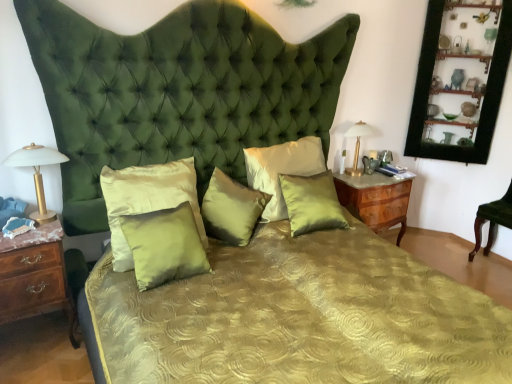
Question: From a real-world perspective, does black wood picture frame at upper right sit lower than satin green pillow at center, which appears as the fifth pillow when viewed from the left?

Choices:
 (A) yes
 (B) no

Answer: (B)

Question: Is black wood picture frame at upper right turned away from satin green pillow at center, which appears as the fifth pillow when viewed from the left?

Choices:
 (A) no
 (B) yes

Answer: (A)

Question: Would you say black wood picture frame at upper right is outside satin green pillow at center, the first pillow when ordered from right to left?

Choices:
 (A) no
 (B) yes

Answer: (B)

Question: Can satin green pillow at center, which appears as the fifth pillow when viewed from the left, be found inside black wood picture frame at upper right?

Choices:
 (A) no
 (B) yes

Answer: (A)

Question: Could you tell me if black wood picture frame at upper right is facing satin green pillow at center, the first pillow when ordered from right to left?

Choices:
 (A) yes
 (B) no

Answer: (B)

Question: In the image, is black wood picture frame at upper right on the left side or the right side of wooden nightstand at left, marked as the first nightstand in a left-to-right arrangement?

Choices:
 (A) left
 (B) right

Answer: (B)

Question: From their relative heights in the image, would you say black wood picture frame at upper right is taller or shorter than wooden nightstand at left, the 1th nightstand when ordered from front to back?

Choices:
 (A) tall
 (B) short

Answer: (A)

Question: Relative to wooden nightstand at left, marked as the first nightstand in a left-to-right arrangement, is black wood picture frame at upper right in front or behind?

Choices:
 (A) behind
 (B) front

Answer: (A)

Question: In terms of width, does black wood picture frame at upper right look wider or thinner when compared to wooden nightstand at left, positioned as the second nightstand in right-to-left order?

Choices:
 (A) thin
 (B) wide

Answer: (A)

Question: From the image's perspective, is matte gold table lamp at left, which is the first bedside lamp in front-to-back order, above or below satin green pillow at center, positioned as the third pillow in right-to-left order?

Choices:
 (A) below
 (B) above

Answer: (B)

Question: In the image, is matte gold table lamp at left, which is the first bedside lamp in front-to-back order, on the left side or the right side of satin green pillow at center, the third pillow in the left-to-right sequence?

Choices:
 (A) left
 (B) right

Answer: (A)

Question: In terms of width, does matte gold table lamp at left, the second bedside lamp in the right-to-left sequence, look wider or thinner when compared to satin green pillow at center, positioned as the third pillow in right-to-left order?

Choices:
 (A) thin
 (B) wide

Answer: (A)

Question: Considering the positions of point [44, 213] and point [209, 220], is point [44, 213] closer or farther from the camera than point [209, 220]?

Choices:
 (A) closer
 (B) farther

Answer: (A)

Question: Is black wood picture frame at upper right inside or outside of satin green pillow at center, the third pillow in the left-to-right sequence?

Choices:
 (A) inside
 (B) outside

Answer: (B)

Question: Is point (453, 157) positioned closer to the camera than point (218, 187)?

Choices:
 (A) farther
 (B) closer

Answer: (A)